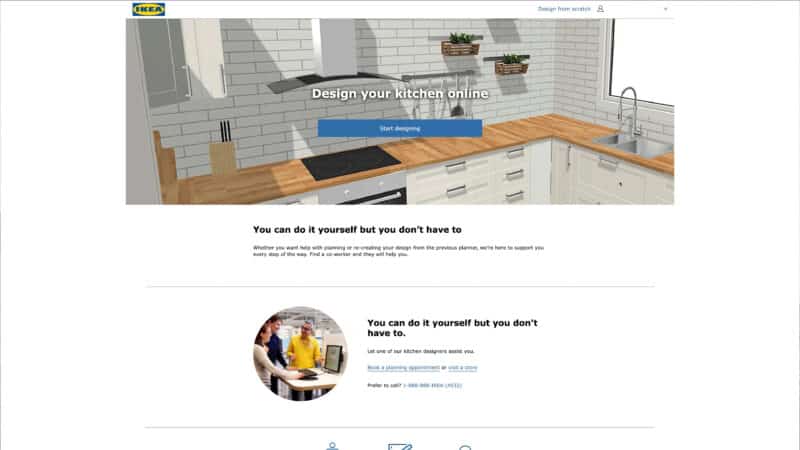
Locate an element on the screen. The image size is (800, 450). kitchen utensils is located at coordinates (413, 112), (458, 105), (434, 109).